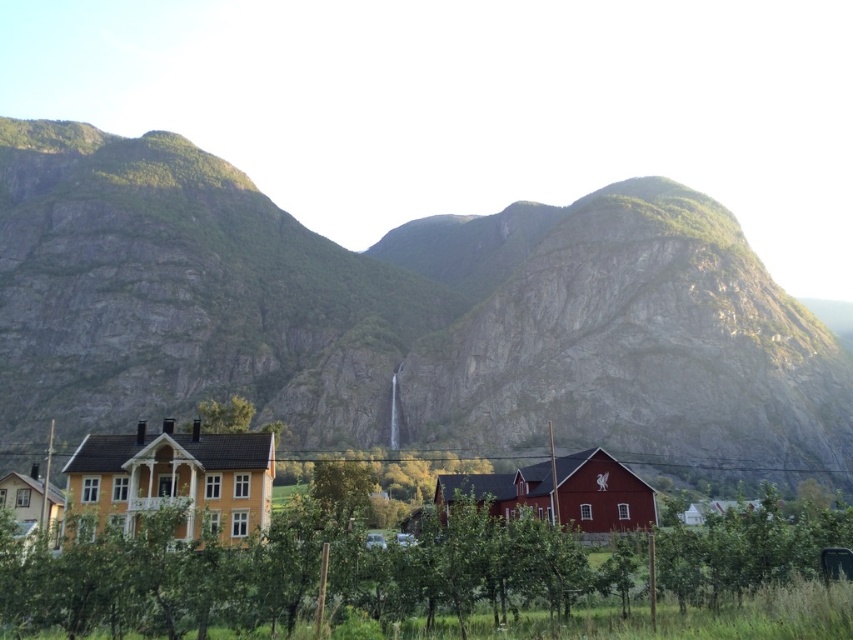
Question: Can you confirm if rough stone mountain at center is positioned below green leafy tree at center?

Choices:
 (A) yes
 (B) no

Answer: (B)

Question: Considering the relative positions of rough stone mountain at center and green leafy tree at center in the image provided, where is rough stone mountain at center located with respect to green leafy tree at center?

Choices:
 (A) right
 (B) left

Answer: (B)

Question: Does rough stone mountain at center have a smaller size compared to green leafy tree at center?

Choices:
 (A) yes
 (B) no

Answer: (B)